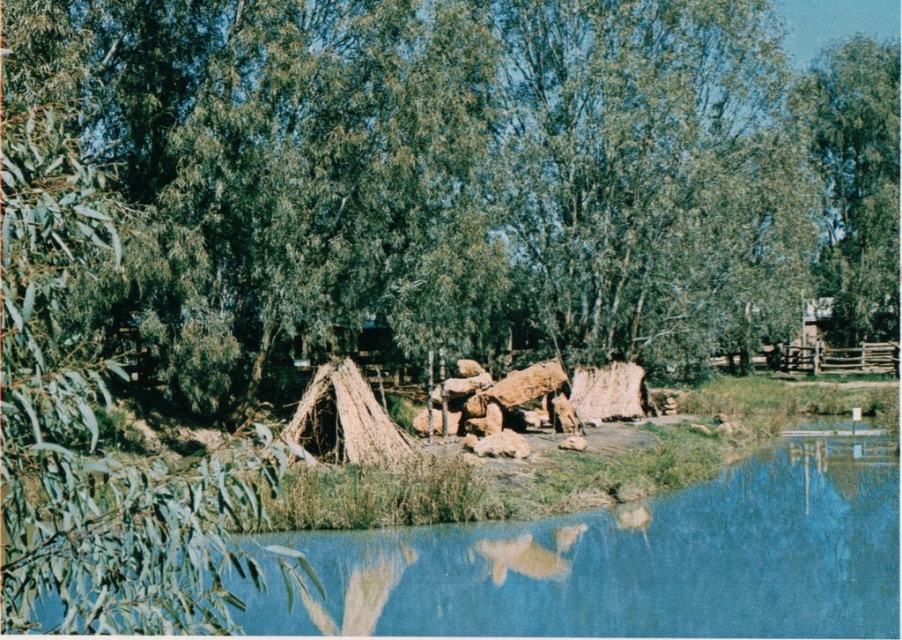
Question: From the image, what is the correct spatial relationship of blue water at lower center in relation to green leafy tree at upper right?

Choices:
 (A) right
 (B) left

Answer: (B)

Question: Does blue water at lower center appear under green leafy tree at upper right?

Choices:
 (A) yes
 (B) no

Answer: (A)

Question: Which point is closer to the camera?

Choices:
 (A) (873, 248)
 (B) (400, 600)

Answer: (B)

Question: Is blue water at lower center to the left of green leafy tree at upper right from the viewer's perspective?

Choices:
 (A) no
 (B) yes

Answer: (B)

Question: Among these objects, which one is nearest to the camera?

Choices:
 (A) blue water at lower center
 (B) green leafy tree at upper right

Answer: (A)